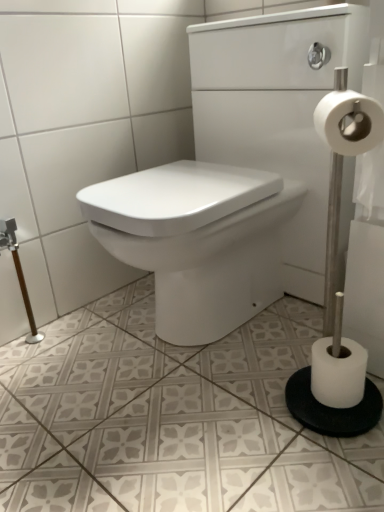
The image size is (384, 512). Identify the location of white matte toilet paper at right. (338, 373).

The width and height of the screenshot is (384, 512). What do you see at coordinates (338, 373) in the screenshot? I see `white matte toilet paper at right` at bounding box center [338, 373].

This screenshot has width=384, height=512. What do you see at coordinates (246, 166) in the screenshot? I see `white glossy sink at center` at bounding box center [246, 166].

Locate an element on the screen. This screenshot has height=512, width=384. white glossy sink at center is located at coordinates (246, 166).

Where is `white matte toilet paper at right`? white matte toilet paper at right is located at coordinates (338, 373).

Can you confirm if white matte toilet paper at right is positioned to the left of white glossy sink at center?

No.

Considering their positions, is white matte toilet paper at right located in front of or behind white glossy sink at center?

white matte toilet paper at right is behind white glossy sink at center.

Which is farther, (343, 387) or (93, 219)?

Point (93, 219)

From the image's perspective, would you say white matte toilet paper at right is shown under white glossy sink at center?

Yes, from the image's perspective, white matte toilet paper at right is beneath white glossy sink at center.

From a real-world perspective, is white matte toilet paper at right below white glossy sink at center?

Yes, from a real-world perspective, white matte toilet paper at right is under white glossy sink at center.

Which object is thinner, white matte toilet paper at right or white glossy sink at center?

With smaller width is white matte toilet paper at right.

Can you confirm if white matte toilet paper at right is taller than white glossy sink at center?

In fact, white matte toilet paper at right may be shorter than white glossy sink at center.

Considering the sizes of white matte toilet paper at right and white glossy sink at center in the image, is white matte toilet paper at right bigger or smaller than white glossy sink at center?

Clearly, white matte toilet paper at right is smaller in size than white glossy sink at center.

Do you think white matte toilet paper at right is within white glossy sink at center, or outside of it?

white matte toilet paper at right is not inside white glossy sink at center, it's outside.

Is white matte toilet paper at right placed right next to white glossy sink at center?

There is a gap between white matte toilet paper at right and white glossy sink at center.

Could you tell me if white matte toilet paper at right is turned towards white glossy sink at center?

No, white matte toilet paper at right is not facing towards white glossy sink at center.

How many degrees apart are the facing directions of white matte toilet paper at right and white glossy sink at center?

They differ by 0.155 degrees in their facing directions.

How distant is white matte toilet paper at right from white glossy sink at center?

A distance of 49.07 centimeters exists between white matte toilet paper at right and white glossy sink at center.

The height and width of the screenshot is (512, 384). In order to click on toilet paper below the white glossy sink at center (from the image's perspective) in this screenshot , I will do `click(338, 373)`.

Between white glossy sink at center and white matte toilet paper at right, which one appears on the left side from the viewer's perspective?

white glossy sink at center.

From the picture: Which object is further away from the camera, white glossy sink at center or white matte toilet paper at right?

white matte toilet paper at right is behind.

Is point (220, 289) farther from viewer compared to point (317, 396)?

Yes, point (220, 289) is farther from viewer.

Based on the photo, from the image's perspective, does white glossy sink at center appear higher than white matte toilet paper at right?

Yes, from the image's perspective, white glossy sink at center is over white matte toilet paper at right.

From a real-world perspective, between white glossy sink at center and white matte toilet paper at right, who is vertically lower?

white matte toilet paper at right is physically lower.

Considering the sizes of objects white glossy sink at center and white matte toilet paper at right in the image provided, who is thinner, white glossy sink at center or white matte toilet paper at right?

white matte toilet paper at right is thinner.

Based on the photo, which of these two, white glossy sink at center or white matte toilet paper at right, stands shorter?

Standing shorter between the two is white matte toilet paper at right.

From the picture: Considering the relative sizes of white glossy sink at center and white matte toilet paper at right in the image provided, is white glossy sink at center bigger than white matte toilet paper at right?

Indeed, white glossy sink at center has a larger size compared to white matte toilet paper at right.

Would you say white glossy sink at center is outside white matte toilet paper at right?

Absolutely, white glossy sink at center is external to white matte toilet paper at right.

Is white glossy sink at center far from white matte toilet paper at right?

No.

Is white glossy sink at center facing towards white matte toilet paper at right?

No, white glossy sink at center is not oriented towards white matte toilet paper at right.

How many degrees apart are the facing directions of white glossy sink at center and white matte toilet paper at right?

The facing directions of white glossy sink at center and white matte toilet paper at right are 0.155 degrees apart.

Where is `sink above the white matte toilet paper at right (from a real-world perspective)`? The width and height of the screenshot is (384, 512). sink above the white matte toilet paper at right (from a real-world perspective) is located at coordinates (246, 166).

Identify the location of sink to the left of white matte toilet paper at right. This screenshot has width=384, height=512. (246, 166).

Where is `sink positioned vertically above the white matte toilet paper at right (from a real-world perspective)`? This screenshot has width=384, height=512. sink positioned vertically above the white matte toilet paper at right (from a real-world perspective) is located at coordinates (246, 166).